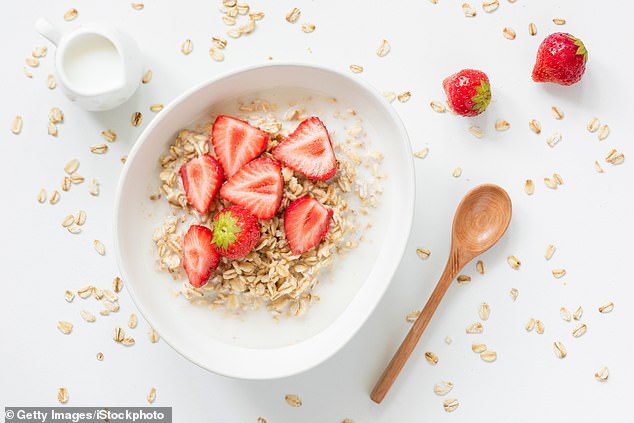
Locate an element on the screen. The image size is (634, 423). white countertop is located at coordinates (503, 406).